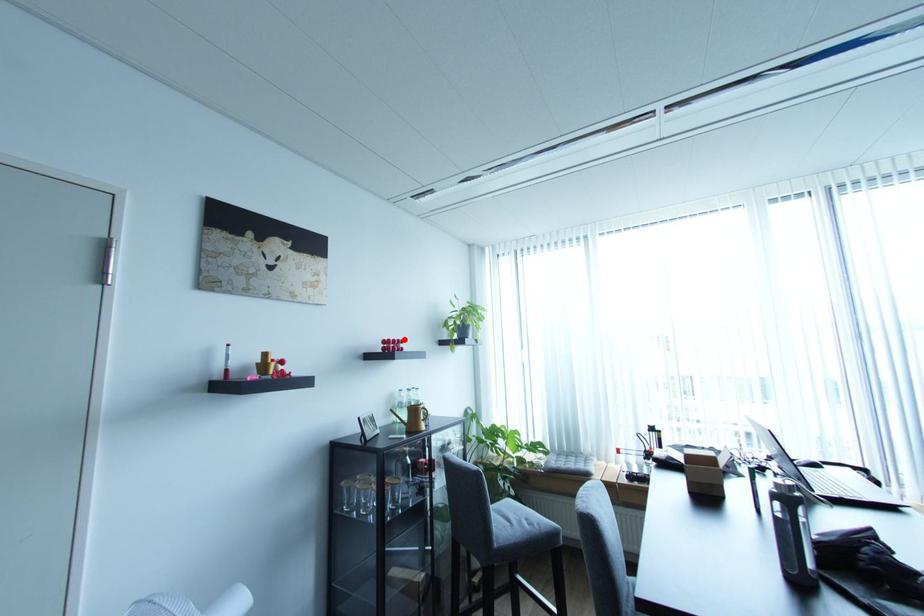
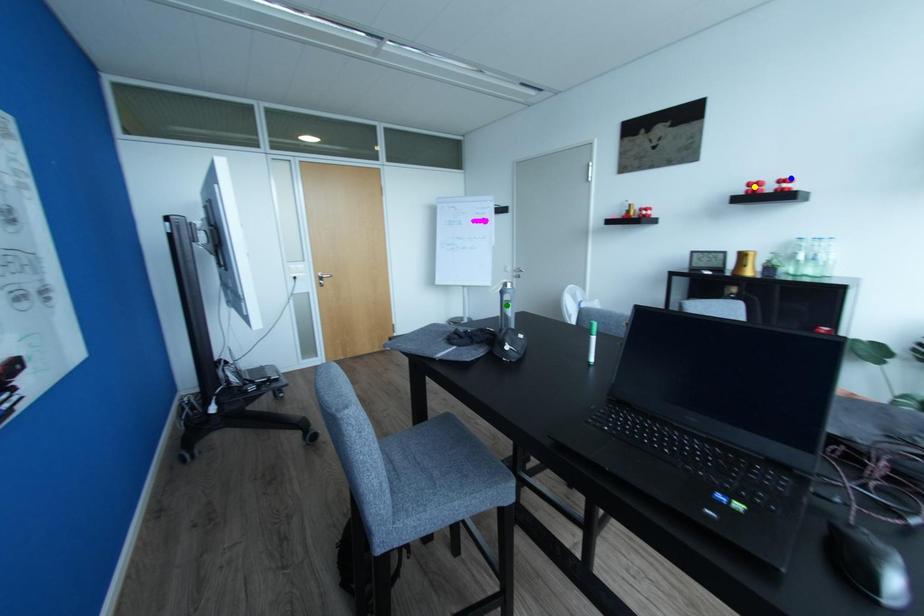
Question: I am providing you with two images of the same scene from different viewpoints. A red point is marked on the first image. You are given multiple points on the second image. Which point in image 2 represents the same 3d spot as the red point in image 1?

Choices:
 (A) blue point
 (B) yellow point
 (C) green point

Answer: (A)